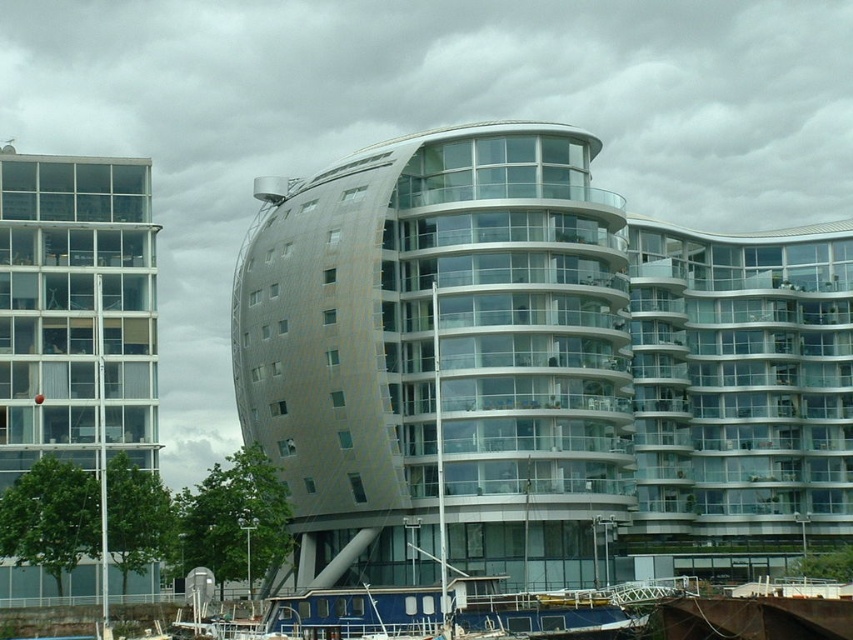
Based on the scene description, what are the coordinates of the sleek metallic building at center?

The sleek metallic building at center is located at coordinates point (537,371).

You are standing in front of the modern architectural complex. You want to take a photo of both the sleek metallic building at center and the clear glass building at left. Which building should you focus on first to ensure both are in the frame?

You should focus on the sleek metallic building at center first because it is closer to you, so adjusting the camera to include it will naturally include the clear glass building at left in the background as well.